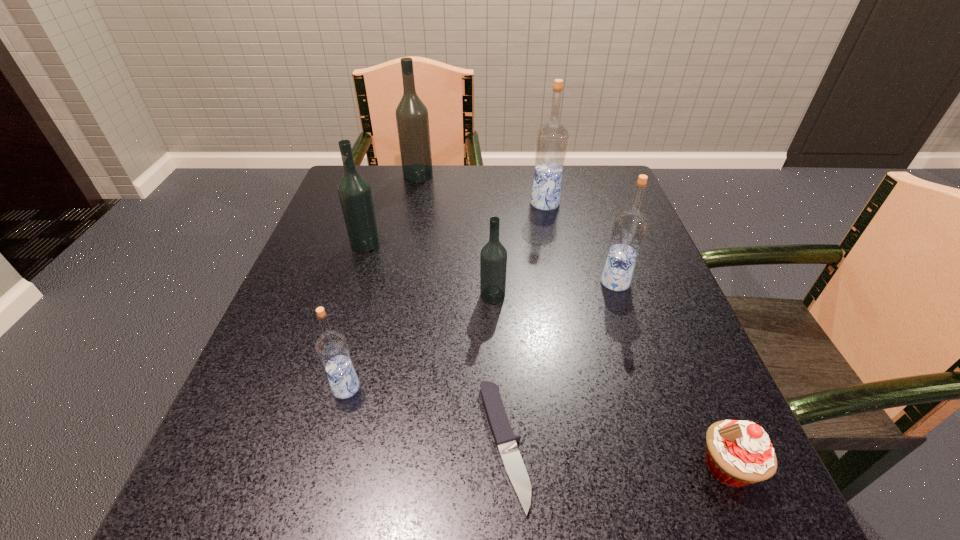
Locate an element on the screen. vacant space positioned on the back of the rightmost black vodka is located at coordinates (492, 255).

At what (x,y) coordinates should I click in order to perform the action: click on vacant space situated on the back of the cupcake. Please return your answer as a coordinate pair (x, y). The height and width of the screenshot is (540, 960). Looking at the image, I should click on (693, 386).

The image size is (960, 540). I want to click on vacant space located 0.080m on the right of the shortest object, so click(583, 444).

Identify the location of cupcake positioned at the near edge. This screenshot has height=540, width=960. (738, 453).

Identify the location of steak knife at the near edge. (505, 440).

This screenshot has width=960, height=540. In order to click on vodka positioned at the right edge in this screenshot , I will do `click(629, 228)`.

Identify the location of cupcake located at the right edge. (738, 453).

Find the location of `object present at the near right corner`. object present at the near right corner is located at coordinates click(738, 453).

Find the location of a particular element. free space at the far edge of the desktop is located at coordinates (481, 188).

Where is `free region at the near edge of the desktop`? The width and height of the screenshot is (960, 540). free region at the near edge of the desktop is located at coordinates (331, 482).